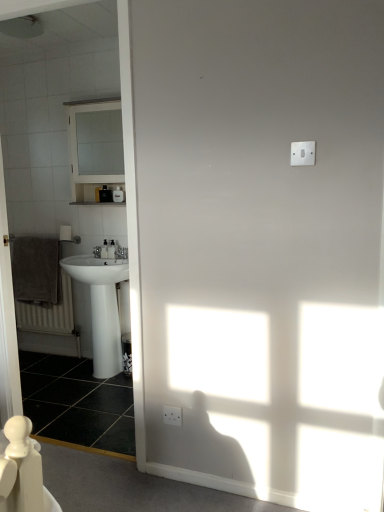
Question: Based on their sizes in the image, would you say brown textured towel at left is bigger or smaller than white glossy sink at left?

Choices:
 (A) small
 (B) big

Answer: (A)

Question: From a real-world perspective, is brown textured towel at left positioned above or below white glossy sink at left?

Choices:
 (A) above
 (B) below

Answer: (B)

Question: Estimate the real-world distances between objects in this image. Which object is farther from the brown textured towel at left?

Choices:
 (A) white glossy sink at left
 (B) white glossy medicine cabinet at upper left
 (C) black glossy tile at lower left

Answer: (B)

Question: Which of these objects is positioned closest to the brown textured towel at left?

Choices:
 (A) white glossy sink at left
 (B) black glossy tile at lower left
 (C) white glossy medicine cabinet at upper left

Answer: (A)